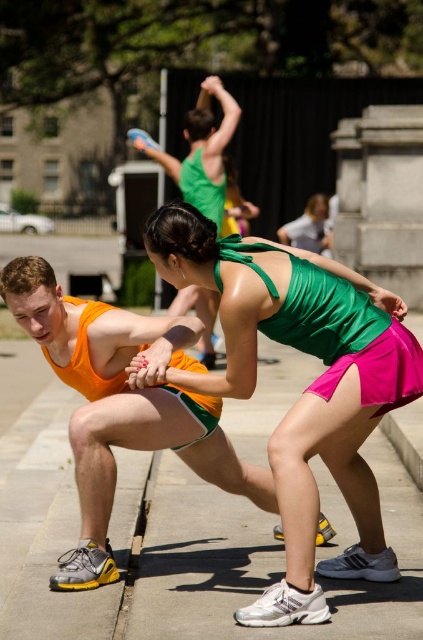
Question: Does green satin tank top at center have a smaller size compared to concrete at lower right?

Choices:
 (A) no
 (B) yes

Answer: (A)

Question: Is green satin tank top at center further to the viewer compared to orange matte tank top at left?

Choices:
 (A) yes
 (B) no

Answer: (B)

Question: Is green satin tank top at center behind concrete at lower right?

Choices:
 (A) no
 (B) yes

Answer: (A)

Question: Which object is the closest to the green satin tank top at center?

Choices:
 (A) orange matte tank top at left
 (B) concrete at lower right

Answer: (A)

Question: Which point is farther from the camera taking this photo?

Choices:
 (A) (230, 316)
 (B) (19, 292)

Answer: (B)

Question: Which of the following is the farthest from the observer?

Choices:
 (A) orange matte tank top at left
 (B) green satin tank top at center

Answer: (A)